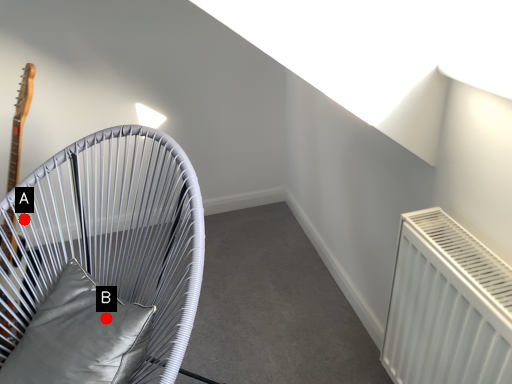
Question: Two points are circled on the image, labeled by A and B beside each circle. Which of the following is the farthest from the observer?

Choices:
 (A) A is further
 (B) B is further

Answer: (A)